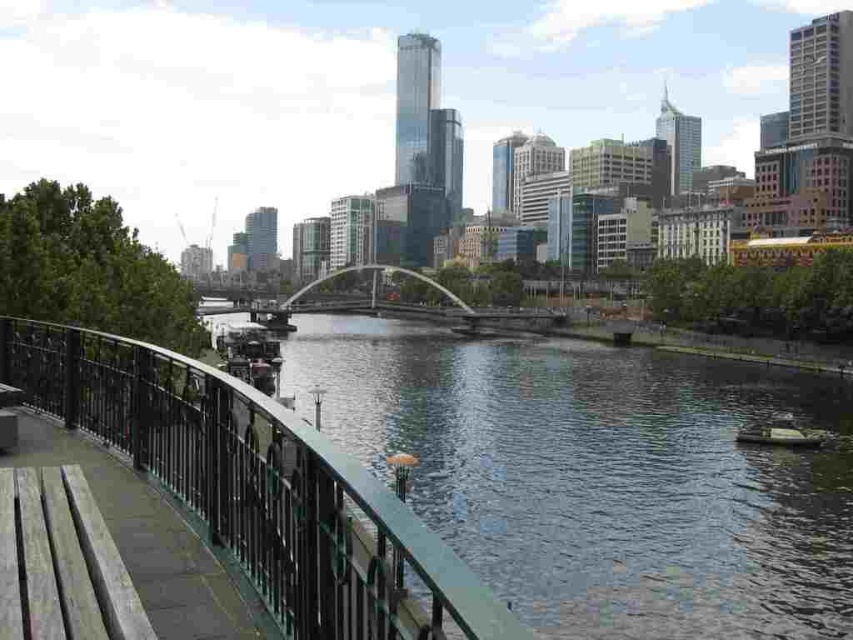
Based on the photo, does green metallic waterway at center appear on the right side of silver metallic bridge at center?

Correct, you'll find green metallic waterway at center to the right of silver metallic bridge at center.

Who is taller, green metallic waterway at center or silver metallic bridge at center?

silver metallic bridge at center

Is point (444, 429) more distant than point (370, 269)?

No, (444, 429) is in front of (370, 269).

The image size is (853, 640). In order to click on green metallic waterway at center in this screenshot , I will do `click(601, 476)`.

Which is more to the left, green painted metal railing at lower left or green plastic boat at lower right?

From the viewer's perspective, green painted metal railing at lower left appears more on the left side.

Is point (279, 602) closer to camera compared to point (764, 435)?

That is True.

Between point (218, 412) and point (737, 433), which one is positioned behind?

The point (737, 433) is more distant.

The image size is (853, 640). In order to click on green painted metal railing at lower left in this screenshot , I will do `click(257, 486)`.

Is point (451, 314) positioned after point (751, 428)?

Yes, it is.

This screenshot has width=853, height=640. What are the coordinates of `silver metallic bridge at center` in the screenshot? It's located at (425, 305).

Identify the location of silver metallic bridge at center. The width and height of the screenshot is (853, 640). (425, 305).